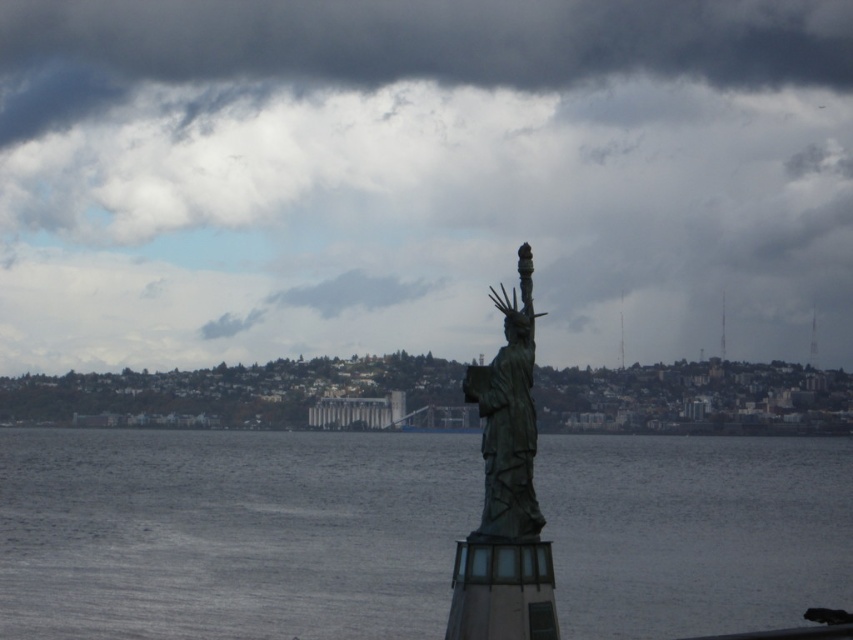
You are a photographer planning to capture the Statue of Liberty and the surrounding water in a single shot. Given that your camera has a fixed focal length, which object between the gray metallic water at center and the bronze statue at center should you focus on to ensure both are in frame?

The gray metallic water at center might be wider than bronze statue at center, so focusing on the bronze statue at center would ensure both are in frame as the statue is narrower and positioned centrally.

You are a photographer planning to capture the Statue of Liberty from this vantage point. You notice the bronze statue at center and the gray metallic water at center. Which object should you adjust your camera focus to first if you want both to be in sharp focus?

The bronze statue at center is behind gray metallic water at center, so you should focus on the bronze statue at center first to ensure both are in sharp focus.